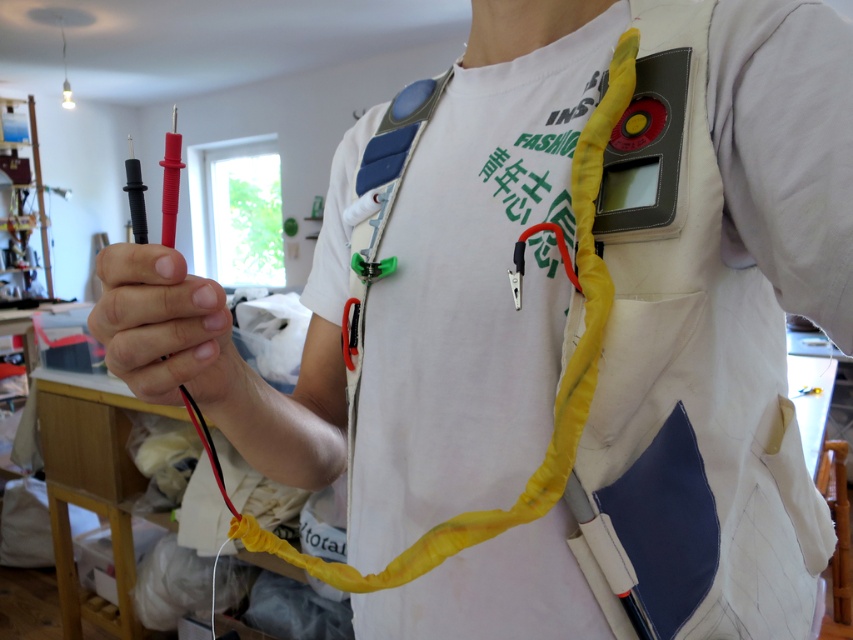
You are an electrician inspecting the vest. You need to reach the black rubber gloves at center and the red plastic multimeter probes at left. Which object is closer to your right hand?

The black rubber gloves at center is positioned on the right side of red plastic multimeter probes at left, so the black rubber gloves at center is closer to your right hand.